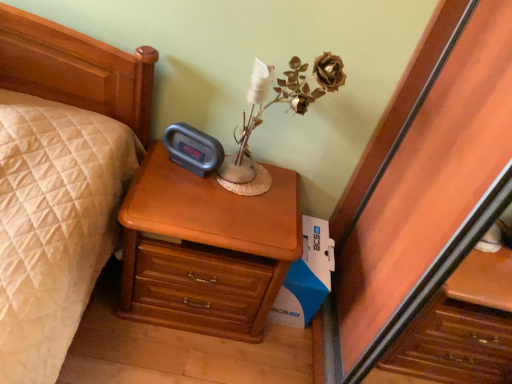
Question: Could you tell me if white cardboard box at lower right is turned towards light brown wood nightstand at center?

Choices:
 (A) yes
 (B) no

Answer: (B)

Question: Would you say white cardboard box at lower right is outside light brown wood nightstand at center?

Choices:
 (A) yes
 (B) no

Answer: (A)

Question: Is white cardboard box at lower right wider than light brown wood nightstand at center?

Choices:
 (A) no
 (B) yes

Answer: (A)

Question: Considering the relative positions of white cardboard box at lower right and light brown wood nightstand at center in the image provided, is white cardboard box at lower right to the right of light brown wood nightstand at center from the viewer's perspective?

Choices:
 (A) no
 (B) yes

Answer: (B)

Question: From the image's perspective, would you say white cardboard box at lower right is positioned over light brown wood nightstand at center?

Choices:
 (A) no
 (B) yes

Answer: (A)

Question: Considering their positions, is brown dried flower at upper right located in front of or behind white cardboard box at lower right?

Choices:
 (A) front
 (B) behind

Answer: (A)

Question: Is brown dried flower at upper right wider or thinner than white cardboard box at lower right?

Choices:
 (A) wide
 (B) thin

Answer: (B)

Question: Is brown dried flower at upper right taller or shorter than white cardboard box at lower right?

Choices:
 (A) short
 (B) tall

Answer: (A)

Question: From a real-world perspective, is brown dried flower at upper right physically located above or below white cardboard box at lower right?

Choices:
 (A) below
 (B) above

Answer: (B)

Question: Considering the positions of point (327, 54) and point (164, 188), is point (327, 54) closer or farther from the camera than point (164, 188)?

Choices:
 (A) closer
 (B) farther

Answer: (A)

Question: Do you think brown dried flower at upper right is within light brown wood nightstand at center, or outside of it?

Choices:
 (A) outside
 (B) inside

Answer: (A)

Question: From their relative heights in the image, would you say brown dried flower at upper right is taller or shorter than light brown wood nightstand at center?

Choices:
 (A) tall
 (B) short

Answer: (B)

Question: Is brown dried flower at upper right to the left or to the right of light brown wood nightstand at center in the image?

Choices:
 (A) left
 (B) right

Answer: (B)

Question: Considering their positions, is light brown wood nightstand at center located in front of or behind white cardboard box at lower right?

Choices:
 (A) behind
 (B) front

Answer: (B)

Question: Is light brown wood nightstand at center wider or thinner than white cardboard box at lower right?

Choices:
 (A) wide
 (B) thin

Answer: (A)